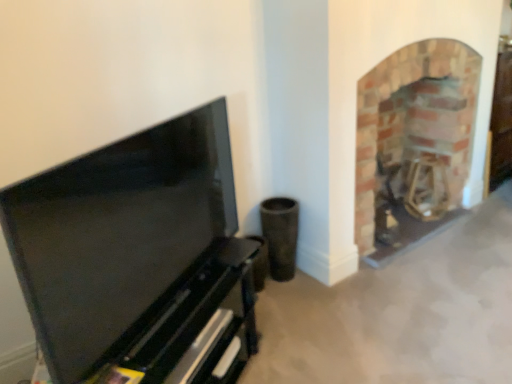
Question: Is brick fireplace at right surrounding matte black tv stand at left?

Choices:
 (A) no
 (B) yes

Answer: (A)

Question: Can you see brick fireplace at right touching matte black tv stand at left?

Choices:
 (A) no
 (B) yes

Answer: (A)

Question: Is brick fireplace at right taller than matte black tv stand at left?

Choices:
 (A) no
 (B) yes

Answer: (B)

Question: From the image's perspective, does brick fireplace at right appear lower than matte black tv stand at left?

Choices:
 (A) yes
 (B) no

Answer: (B)

Question: Can you confirm if brick fireplace at right is wider than matte black tv stand at left?

Choices:
 (A) yes
 (B) no

Answer: (A)

Question: Is brick fireplace at right positioned before matte black tv stand at left?

Choices:
 (A) no
 (B) yes

Answer: (A)

Question: From a real-world perspective, is matte black tv stand at left located beneath brick fireplace at right?

Choices:
 (A) yes
 (B) no

Answer: (B)

Question: Can you confirm if matte black tv stand at left is smaller than brick fireplace at right?

Choices:
 (A) yes
 (B) no

Answer: (A)

Question: From a real-world perspective, is matte black tv stand at left on top of brick fireplace at right?

Choices:
 (A) yes
 (B) no

Answer: (A)

Question: Is brick fireplace at right at the back of matte black tv stand at left?

Choices:
 (A) no
 (B) yes

Answer: (A)

Question: Is matte black tv stand at left not inside brick fireplace at right?

Choices:
 (A) yes
 (B) no

Answer: (A)

Question: Is matte black tv stand at left to the right of brick fireplace at right from the viewer's perspective?

Choices:
 (A) yes
 (B) no

Answer: (B)

Question: In terms of width, does brick fireplace at right look wider or thinner when compared to matte black tv stand at left?

Choices:
 (A) wide
 (B) thin

Answer: (A)